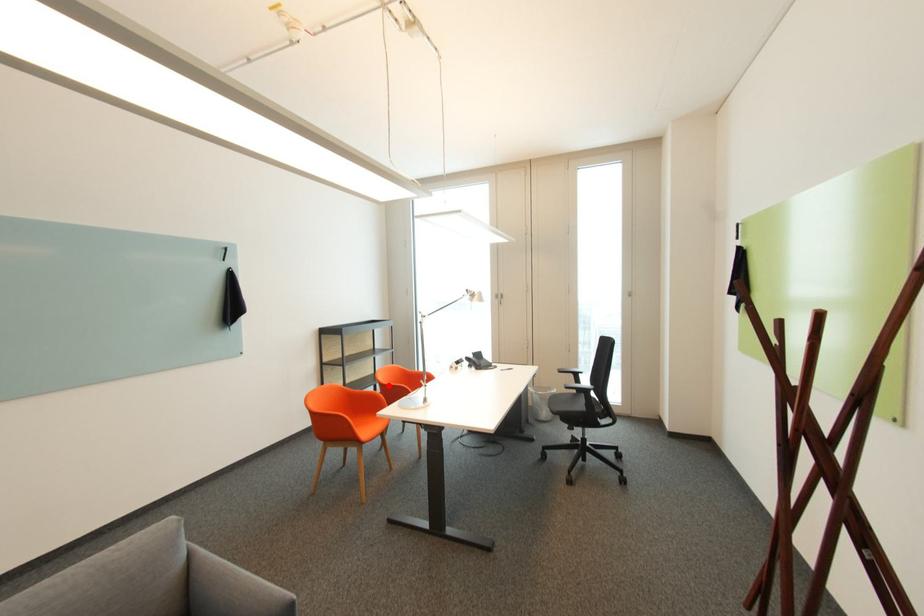
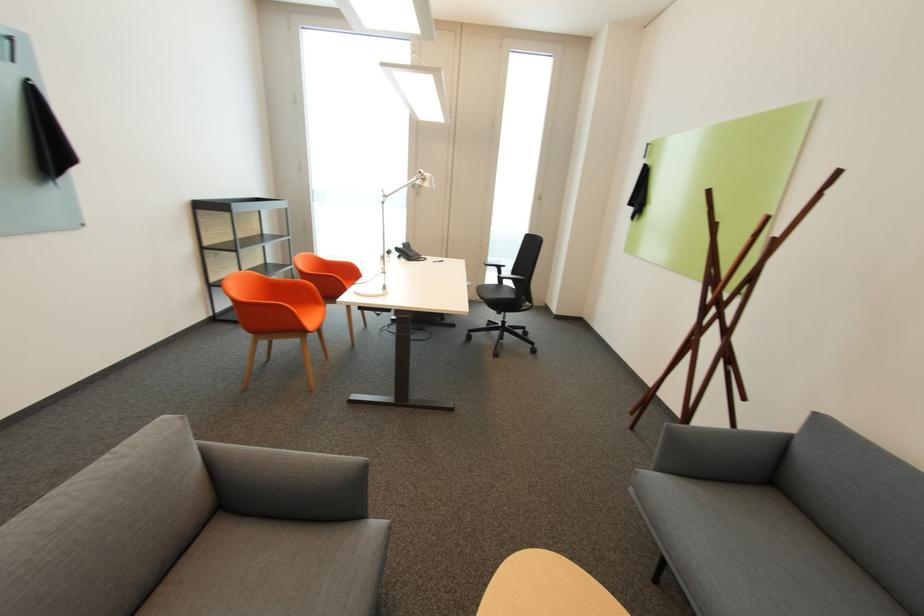
Find the pixel in the second image that matches the highlighted location in the first image.

(310, 275)